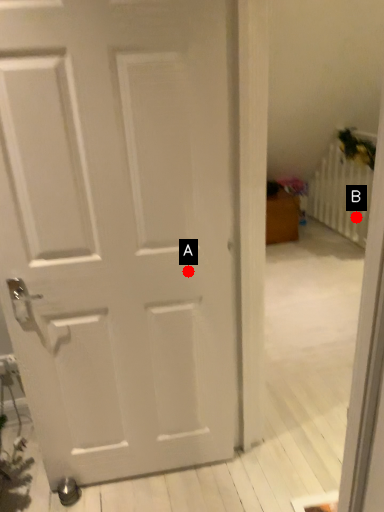
Question: Two points are circled on the image, labeled by A and B beside each circle. Which point is farther to the camera?

Choices:
 (A) A is further
 (B) B is further

Answer: (B)